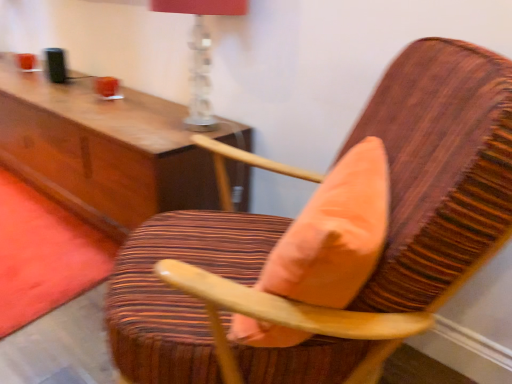
Question: Which direction should I rotate to look at wooden chair with striped upholstery at center?

Choices:
 (A) right
 (B) left

Answer: (A)

Question: Does coral velvet throw pillow at center come behind translucent glass table lamp at upper center?

Choices:
 (A) yes
 (B) no

Answer: (B)

Question: Considering the relative sizes of coral velvet throw pillow at center and translucent glass table lamp at upper center in the image provided, is coral velvet throw pillow at center smaller than translucent glass table lamp at upper center?

Choices:
 (A) yes
 (B) no

Answer: (A)

Question: Is coral velvet throw pillow at center not close to translucent glass table lamp at upper center?

Choices:
 (A) yes
 (B) no

Answer: (B)

Question: Could translucent glass table lamp at upper center be considered to be inside coral velvet throw pillow at center?

Choices:
 (A) no
 (B) yes

Answer: (A)

Question: Can you confirm if coral velvet throw pillow at center is shorter than translucent glass table lamp at upper center?

Choices:
 (A) yes
 (B) no

Answer: (A)

Question: Considering the relative sizes of coral velvet throw pillow at center and translucent glass table lamp at upper center in the image provided, is coral velvet throw pillow at center thinner than translucent glass table lamp at upper center?

Choices:
 (A) no
 (B) yes

Answer: (B)

Question: Is translucent glass table lamp at upper center positioned far away from coral velvet throw pillow at center?

Choices:
 (A) yes
 (B) no

Answer: (B)

Question: Considering the relative sizes of translucent glass table lamp at upper center and coral velvet throw pillow at center in the image provided, is translucent glass table lamp at upper center bigger than coral velvet throw pillow at center?

Choices:
 (A) yes
 (B) no

Answer: (A)

Question: Is translucent glass table lamp at upper center looking in the opposite direction of coral velvet throw pillow at center?

Choices:
 (A) yes
 (B) no

Answer: (B)

Question: Considering the relative sizes of translucent glass table lamp at upper center and coral velvet throw pillow at center in the image provided, is translucent glass table lamp at upper center thinner than coral velvet throw pillow at center?

Choices:
 (A) yes
 (B) no

Answer: (B)

Question: Is translucent glass table lamp at upper center not inside coral velvet throw pillow at center?

Choices:
 (A) no
 (B) yes

Answer: (B)

Question: Can you confirm if translucent glass table lamp at upper center is positioned to the left of coral velvet throw pillow at center?

Choices:
 (A) no
 (B) yes

Answer: (B)

Question: Does wooden chair with striped upholstery at center have a smaller size compared to translucent glass table lamp at upper center?

Choices:
 (A) no
 (B) yes

Answer: (A)